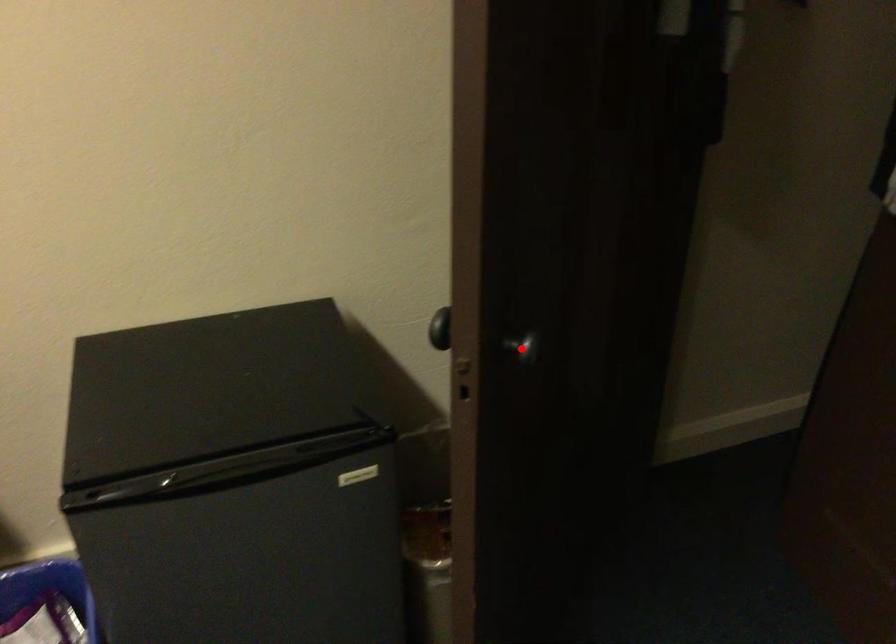
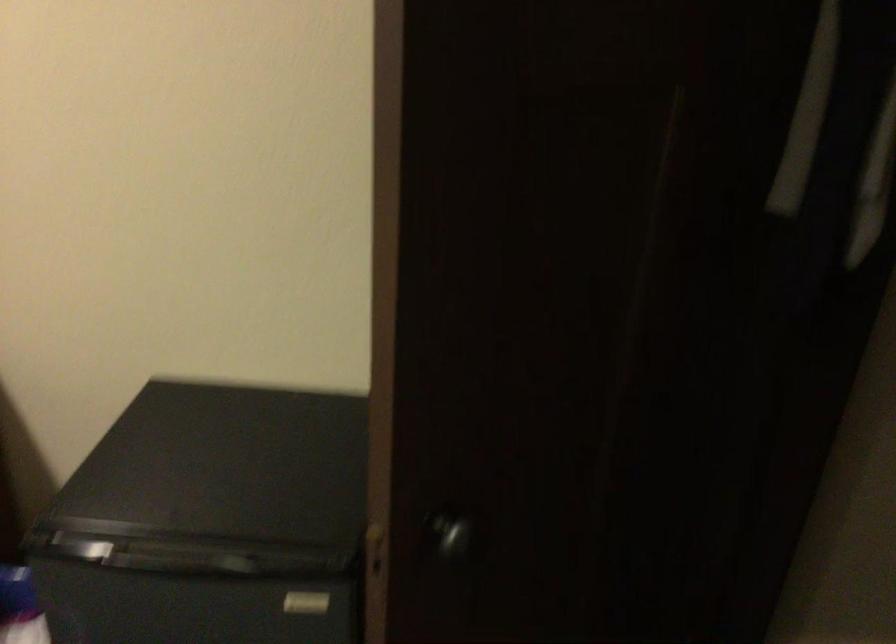
Question: A red point is marked in image1. In image2, is the corresponding 3D point closer to the camera or farther? Reply with the corresponding letter.

Choices:
 (A) The corresponding 3D point is closer.
 (B) The corresponding 3D point is farther.

Answer: (A)